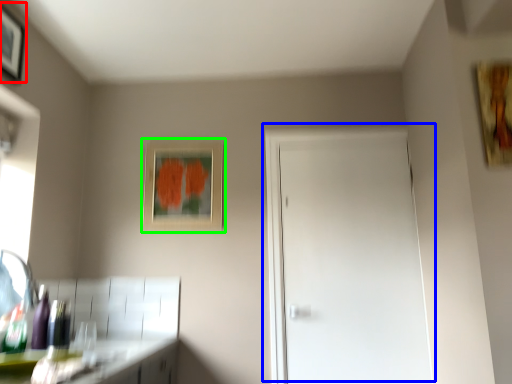
Question: Based on their relative distances, which object is farther from picture frame (highlighted by a red box)? Choose from door (highlighted by a blue box) and picture frame (highlighted by a green box).

Choices:
 (A) door
 (B) picture frame

Answer: (A)